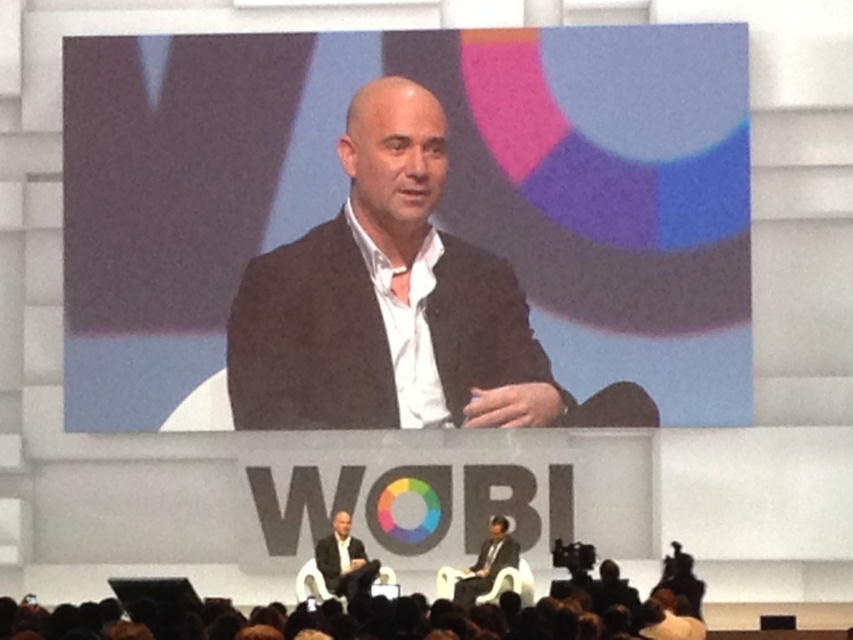
Question: Which is farther from the brown hair at lower center?

Choices:
 (A) matte black screen at center
 (B) dark gray suit at center

Answer: (A)

Question: Is brown hair at lower center closer to the viewer compared to dark gray suit at center?

Choices:
 (A) no
 (B) yes

Answer: (B)

Question: Can you confirm if matte black screen at center is positioned below dark gray suit at center?

Choices:
 (A) no
 (B) yes

Answer: (A)

Question: Which is nearer to the matte black screen at center?

Choices:
 (A) brown hair at lower center
 (B) dark gray suit at center

Answer: (A)

Question: Does brown hair at lower center appear on the left side of dark gray suit at center?

Choices:
 (A) no
 (B) yes

Answer: (A)

Question: Estimate the real-world distances between objects in this image. Which object is farther from the brown hair at lower center?

Choices:
 (A) dark gray suit at center
 (B) matte black screen at center

Answer: (B)